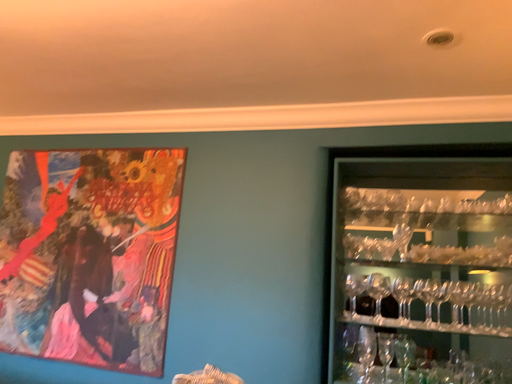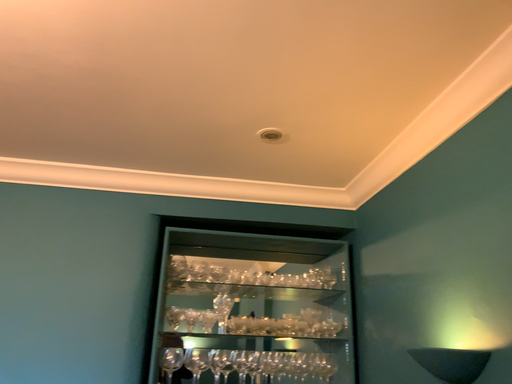
Question: Which way did the camera rotate in the video?

Choices:
 (A) rotated right
 (B) rotated left

Answer: (A)